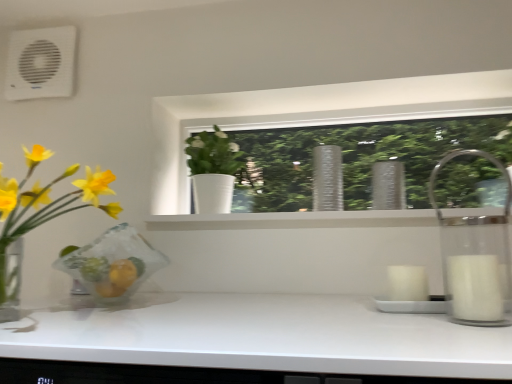
Question: Does clear glass vase at center have a greater width compared to white plastic air conditioning unit at upper left?

Choices:
 (A) yes
 (B) no

Answer: (A)

Question: From a real-world perspective, is clear glass vase at center below white plastic air conditioning unit at upper left?

Choices:
 (A) yes
 (B) no

Answer: (A)

Question: Can you confirm if clear glass vase at center is thinner than white plastic air conditioning unit at upper left?

Choices:
 (A) yes
 (B) no

Answer: (B)

Question: From a real-world perspective, is clear glass vase at center on white plastic air conditioning unit at upper left?

Choices:
 (A) yes
 (B) no

Answer: (B)

Question: Is clear glass vase at center looking in the opposite direction of white plastic air conditioning unit at upper left?

Choices:
 (A) no
 (B) yes

Answer: (A)

Question: Is clear glass vase at center with white plastic air conditioning unit at upper left?

Choices:
 (A) no
 (B) yes

Answer: (A)

Question: Is white matte pot at center, the 2th houseplant in the left-to-right sequence, shorter than white plastic air conditioning unit at upper left?

Choices:
 (A) yes
 (B) no

Answer: (B)

Question: Does white matte pot at center, the 1th houseplant in the right-to-left sequence, contain white plastic air conditioning unit at upper left?

Choices:
 (A) yes
 (B) no

Answer: (B)

Question: Is white matte pot at center, the first houseplant positioned from the back, bigger than white plastic air conditioning unit at upper left?

Choices:
 (A) yes
 (B) no

Answer: (A)

Question: Is white matte pot at center, the 2th houseplant in the left-to-right sequence, not inside white plastic air conditioning unit at upper left?

Choices:
 (A) yes
 (B) no

Answer: (A)

Question: From a real-world perspective, does white matte pot at center, the 2th houseplant in the left-to-right sequence, sit lower than white plastic air conditioning unit at upper left?

Choices:
 (A) no
 (B) yes

Answer: (B)

Question: Does white matte pot at center, the first houseplant positioned from the back, have a greater width compared to white plastic air conditioning unit at upper left?

Choices:
 (A) no
 (B) yes

Answer: (B)

Question: Is clear glass vase at center not near translucent glass vase at left, positioned as the second houseplant in right-to-left order?

Choices:
 (A) no
 (B) yes

Answer: (A)